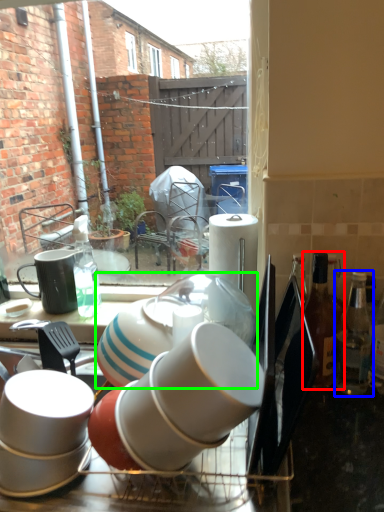
Question: Which is nearer to the bottle (highlighted by a red box)? bottle (highlighted by a blue box) or tableware (highlighted by a green box).

Choices:
 (A) bottle
 (B) tableware

Answer: (A)